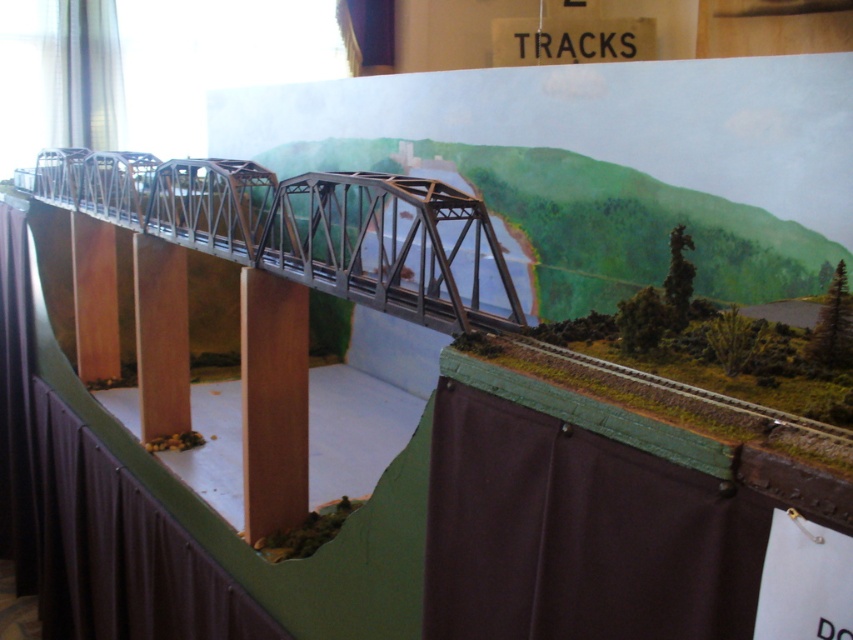
You are a model train engineer planning a route through the bridge. You need to know the position of the metallic gray bridge at center relative to the brown wood pillar at center to ensure safe passage. Is the bridge to the left or right of the pillar?

The metallic gray bridge at center is positioned on the left side of brown wood pillar at center, so the bridge is to the left of the pillar.

You are a model train engineer who needs to place a new train car that is 1.2 meters long on the track. The metallic gray bridge at center is part of the track. Can the train car fit on the bridge if the bridge is 1.36 meters away from you?

The metallic gray bridge at center is 1.36 meters away from the camera, so the train car that is 1.2 meters long can fit on the bridge since it is shorter than the bridge distance.